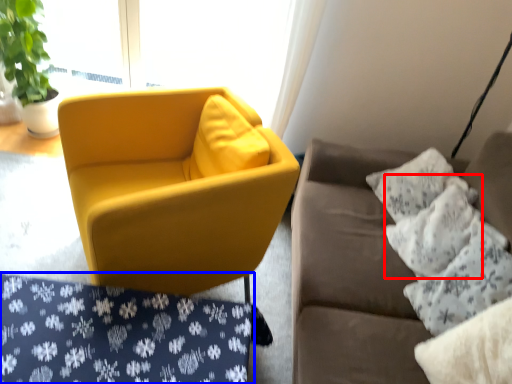
Question: Which point is closer to the camera, pillow (highlighted by a red box) or pattern (highlighted by a blue box)?

Choices:
 (A) pillow
 (B) pattern

Answer: (B)